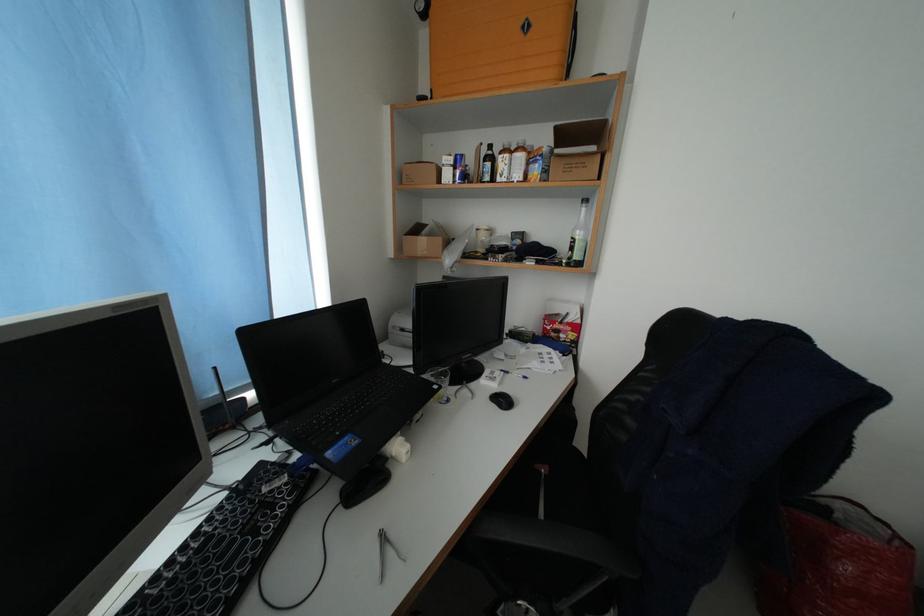
The height and width of the screenshot is (616, 924). What do you see at coordinates (464, 390) in the screenshot? I see `the metal pliers` at bounding box center [464, 390].